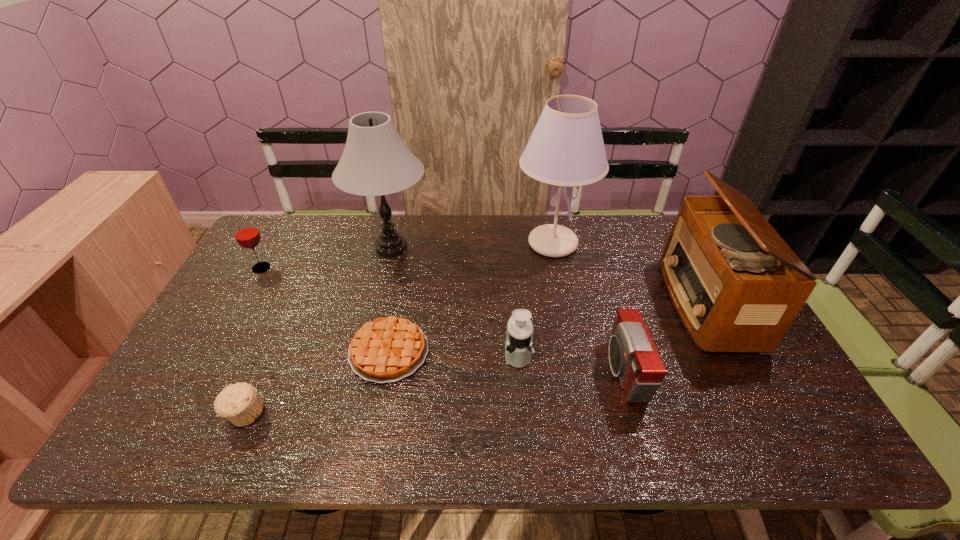
You are a GUI agent. You are given a task and a screenshot of the screen. Output one action in this format:
    pyautogui.click(x=<x>, y=<y>)
    Task: Click on the free point between the radio receiver and the camera
    
    Given the screenshot: What is the action you would take?
    pyautogui.click(x=664, y=337)

Image resolution: width=960 pixels, height=540 pixels. What are the coordinates of `vacant space that is in between the camera and the shortest object` in the screenshot? It's located at (506, 361).

Find the location of a particular element. vacant space in between the muffin and the lamp is located at coordinates (318, 331).

Locate an element on the screen. the seventh closest object to the lamp is located at coordinates (727, 271).

Point out which object is positioned as the fifth nearest to the lamp. Please provide its 2D coordinates. Your answer should be formatted as a tuple, i.e. [(x, y)], where the tuple contains the x and y coordinates of a point satisfying the conditions above.

[(241, 403)]